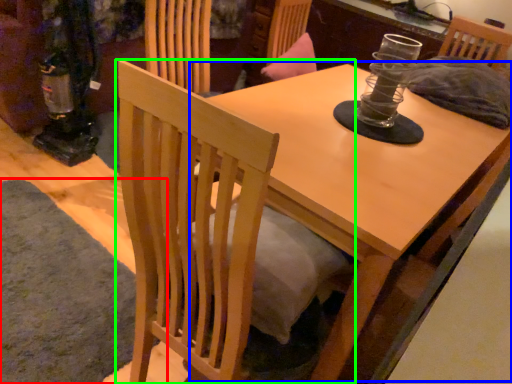
Question: Which is farther away from mat (highlighted by a red box)? round table (highlighted by a blue box) or chair (highlighted by a green box)?

Choices:
 (A) round table
 (B) chair

Answer: (A)